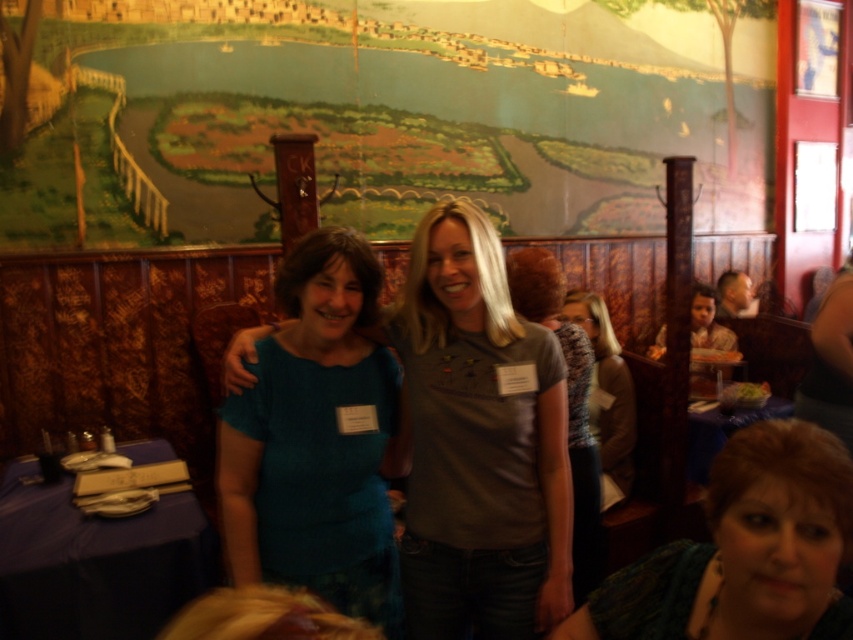
Is green painted wall at upper center below teal fabric shirt at center?

No, green painted wall at upper center is not below teal fabric shirt at center.

Can you confirm if green painted wall at upper center is positioned to the left of teal fabric shirt at center?

Incorrect, green painted wall at upper center is not on the left side of teal fabric shirt at center.

Find the location of `green painted wall at upper center`. green painted wall at upper center is located at coordinates (378, 118).

Can you confirm if green painted wall at upper center is wider than green textured blouse at lower right?

Indeed, green painted wall at upper center has a greater width compared to green textured blouse at lower right.

At what (x,y) coordinates should I click in order to perform the action: click on green painted wall at upper center. Please return your answer as a coordinate pair (x, y). Image resolution: width=853 pixels, height=640 pixels. Looking at the image, I should click on (378, 118).

Who is more forward, [65,112] or [743,616]?

Point [743,616] is in front.

Locate an element on the screen. This screenshot has width=853, height=640. green painted wall at upper center is located at coordinates tap(378, 118).

Is green textured blouse at lower right shorter than gray textured sweater at center?

Yes, green textured blouse at lower right is shorter than gray textured sweater at center.

Which is more to the left, green textured blouse at lower right or gray textured sweater at center?

Positioned to the left is green textured blouse at lower right.

In order to click on green textured blouse at lower right in this screenshot , I will do `click(746, 548)`.

In order to click on green textured blouse at lower right in this screenshot , I will do 746,548.